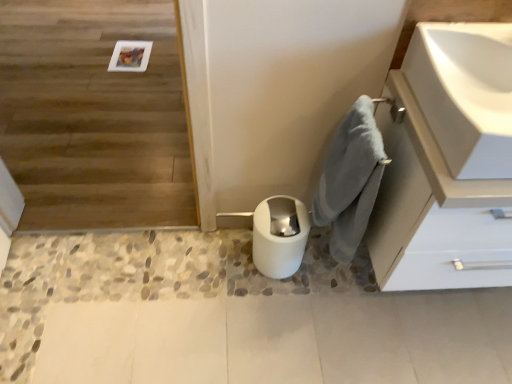
I want to click on free location in front of white glossy toilet bowl at lower center, so [x=272, y=309].